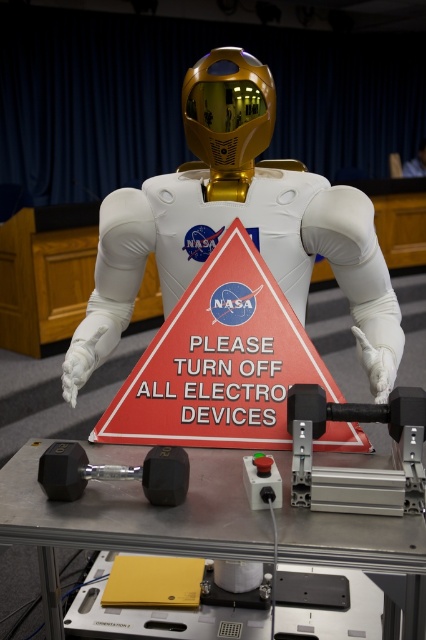
Question: Which point appears farthest from the camera in this image?

Choices:
 (A) (290, 180)
 (B) (143, 529)

Answer: (A)

Question: Among these points, which one is farthest from the camera?

Choices:
 (A) (287, 385)
 (B) (241, 513)
 (C) (108, 342)

Answer: (C)

Question: Considering the relative positions of white matte astronaut at center and metallic gray table at center in the image provided, where is white matte astronaut at center located with respect to metallic gray table at center?

Choices:
 (A) right
 (B) left

Answer: (A)

Question: Among these points, which one is nearest to the camera?

Choices:
 (A) (169, 337)
 (B) (189, 188)
 (C) (317, 547)

Answer: (C)

Question: Does white matte astronaut at center have a smaller size compared to metallic gray table at center?

Choices:
 (A) yes
 (B) no

Answer: (B)

Question: Does metallic gray table at center have a greater width compared to red plastic sign at center?

Choices:
 (A) no
 (B) yes

Answer: (B)